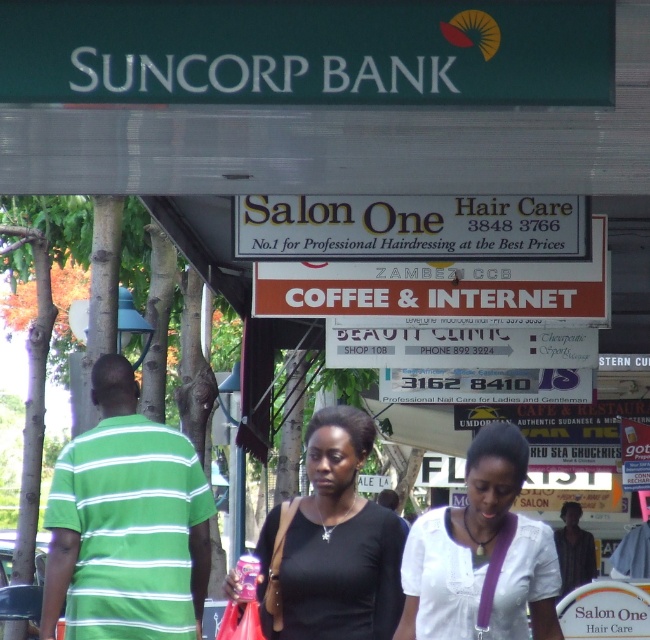
You are a photographer standing in the street scene. You want to take a photo of the green striped shirt at center and the black matte shirt at center. Which one should you pan your camera to the left to capture first?

The green striped shirt at center is to the left of the black matte shirt at center, so you should pan your camera to the left to capture the green striped shirt at center first before moving to the right to include the black matte shirt at center.

You are a photographer trying to capture both the green striped shirt at center and the black matte shirt at center in a single frame. Given that your camera can only focus on objects within a 1.2 meter height range, can both be included in the shot?

The green striped shirt at center is smaller than the black matte shirt at center, so the height difference between them might be within the 1.2 meter range, allowing both to be captured in the frame.

You are a photographer trying to capture a candid shot of the two people in the center of the image. Given that your camera can only focus on one subject at a time, which of the two, the black matte shirt at center or the white matte shirt at center, should you choose to ensure the subject fills the frame better?

The black matte shirt at center has a larger width than the white matte shirt at center, so choosing the black matte shirt at center will allow it to fill the frame better.